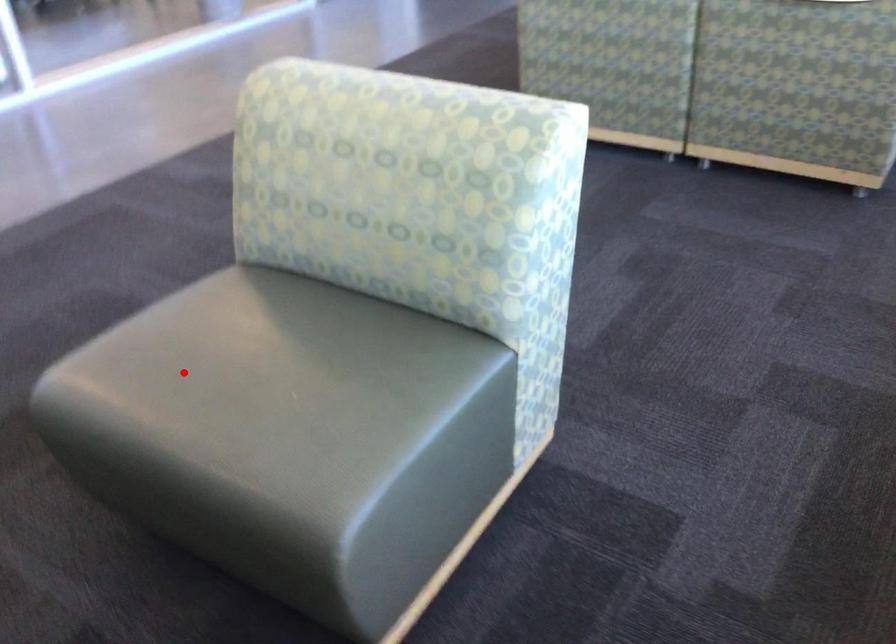
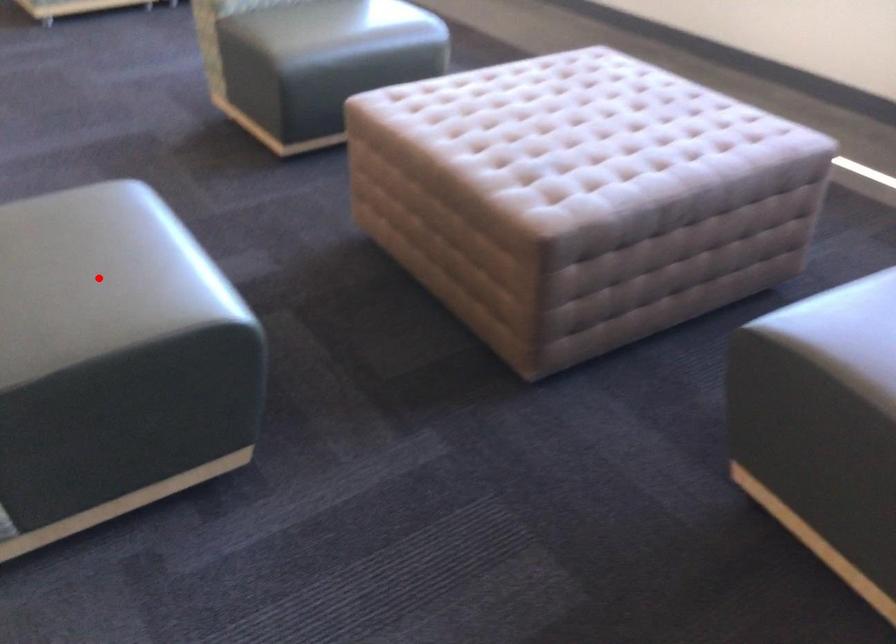
I am providing you with two images of the same scene from different viewpoints. A red point is marked on the first image and another point is marked on the second image. Are the points marked in image1 and image2 representing the same 3D position?

No